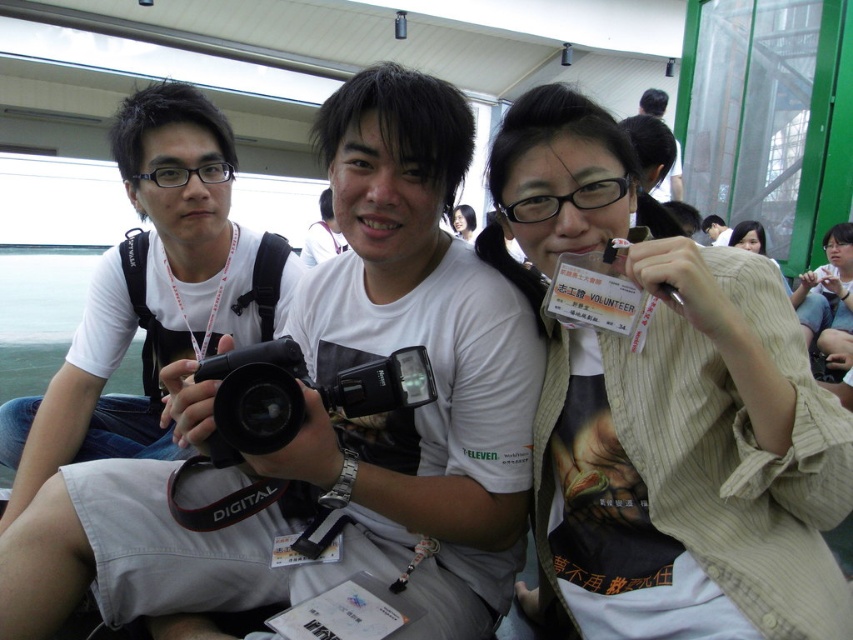
You are standing in the room and want to take a photo of both the point at coordinates (x=234, y=317) and the point at (x=287, y=403). Which point should you focus on first to ensure both are in focus?

You should focus on the point at (x=287, y=403) first because it is closer to you than the point at (x=234, y=317), which is further away. By focusing on the closer point, the further point will also be within the depth of field, ensuring both are in focus.

You are standing at the origin point of the coordinate system in the image. You need to move towards the point labeled point [752,250]. Will you pass by point [462,234] before reaching your destination?

Yes, because point [752,250] is in front of point [462,234], so you will pass by point [462,234] before reaching your destination.

You are a photographer trying to adjust your equipment. You notice the black matte camera at center and the matte white shirt at center. Which object is positioned higher in the image?

The black matte camera at center is located above the matte white shirt at center, so it is positioned higher in the image.